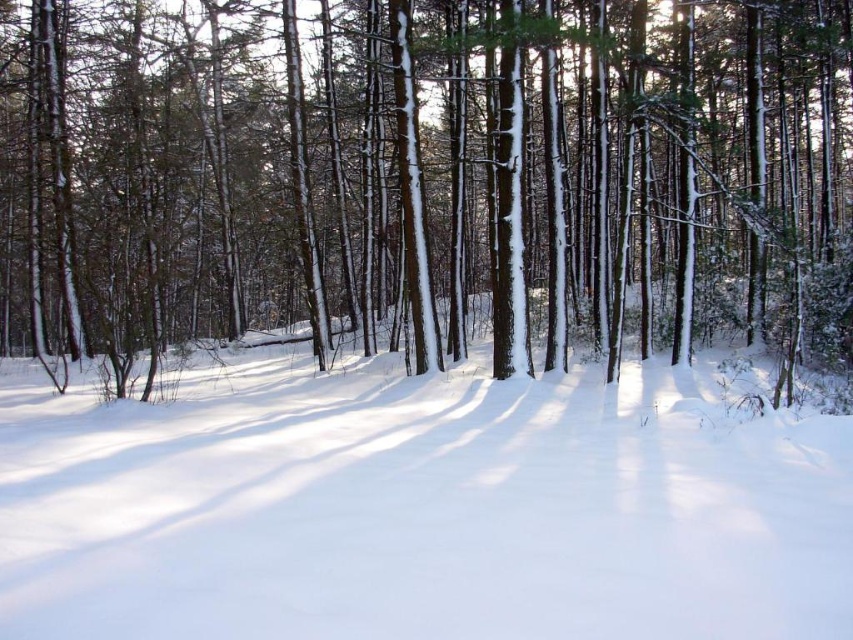
You are a photographer planning to capture a closeup of the smooth bark tree at center and the white fluffy snow at center. Since you want to focus on the tree, which object should you prioritize in your composition to ensure the tree is the main subject?

The smooth bark tree at center is wider than the white fluffy snow at center, so you should prioritize the smooth bark tree at center in your composition to make it the main subject.

You are standing in the winter forest and want to locate the smooth bark tree at center. According to the coordinates provided, where should you look relative to your current position?

The smooth bark tree at center is located at coordinates point (426, 179), so you should look slightly to the left and down from your current position.

You are standing in the winter forest scene and want to move from the point closer to the camera to the point further away. Which path should you take between the two points, point (138, 112) and point (502, 490)?

You should move towards point (502, 490) because it is further away from the camera compared to point (138, 112).